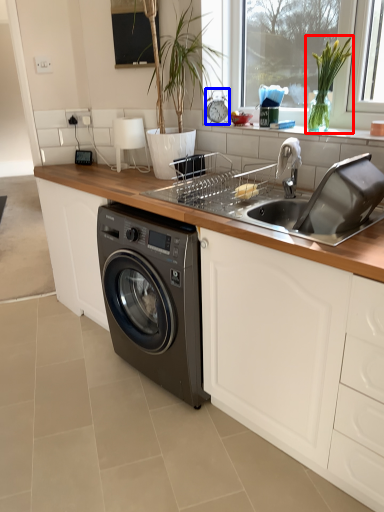
Question: Among these objects, which one is farthest to the camera, plant (highlighted by a red box) or appliance (highlighted by a blue box)?

Choices:
 (A) plant
 (B) appliance

Answer: (B)